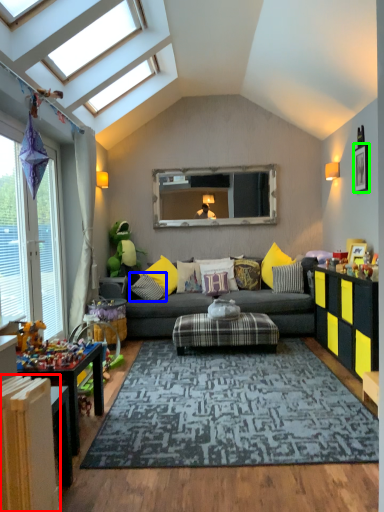
Question: Which is farther away from radiator (highlighted by a red box)? pillow (highlighted by a blue box) or picture frame (highlighted by a green box)?

Choices:
 (A) pillow
 (B) picture frame

Answer: (B)